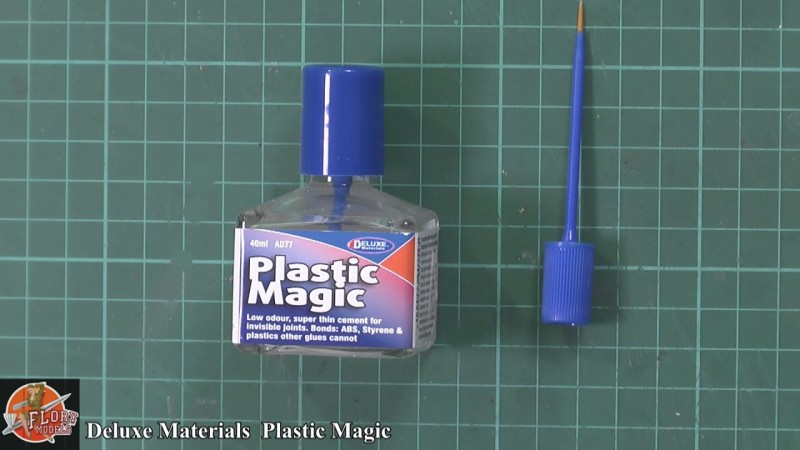
In order to click on applicator brush in this screenshot , I will do `click(582, 22)`.